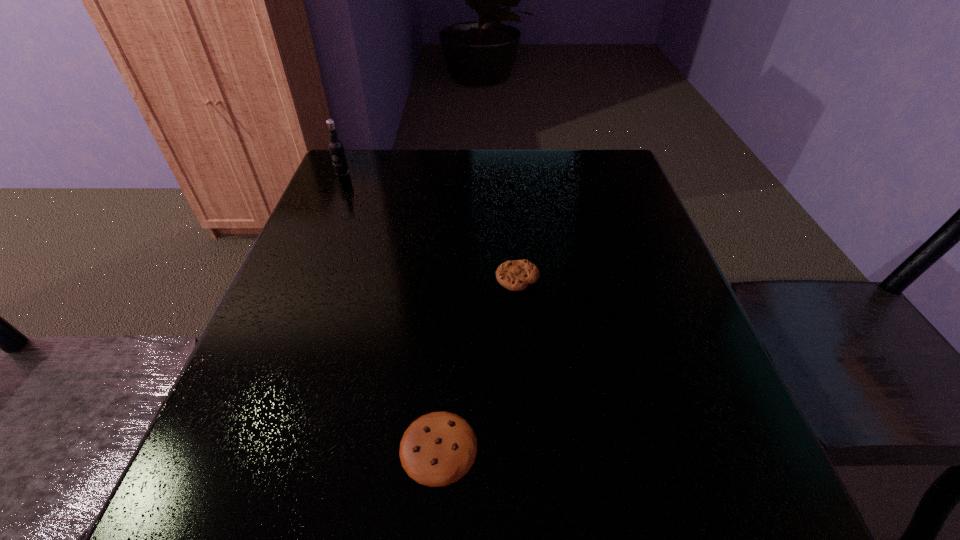
Identify the location of unoccupied position between the shortest object and the root beer. 391,310.

Locate an element on the screen. free space between the shorter cookie and the tallest object is located at coordinates (391, 310).

The height and width of the screenshot is (540, 960). I want to click on unoccupied position between the nearest object and the tallest object, so click(x=391, y=310).

This screenshot has height=540, width=960. I want to click on vacant space that's between the right cookie and the shortest object, so click(478, 363).

I want to click on vacant area between the nearer cookie and the second shortest object, so click(x=478, y=363).

You are a GUI agent. You are given a task and a screenshot of the screen. Output one action in this format:
    pyautogui.click(x=<x>, y=<y>)
    Task: Click on the free space between the right cookie and the nearest object
    The image size is (960, 540).
    Given the screenshot: What is the action you would take?
    pyautogui.click(x=478, y=363)

Locate an element on the screen. The height and width of the screenshot is (540, 960). blank region between the tallest object and the second farthest object is located at coordinates (430, 226).

Find the location of a particular element. free space between the left cookie and the second shortest object is located at coordinates (478, 363).

The height and width of the screenshot is (540, 960). What are the coordinates of `empty location between the nearer cookie and the root beer` in the screenshot? It's located at click(391, 310).

This screenshot has width=960, height=540. I want to click on object that can be found as the second closest to the farthest object, so click(x=439, y=448).